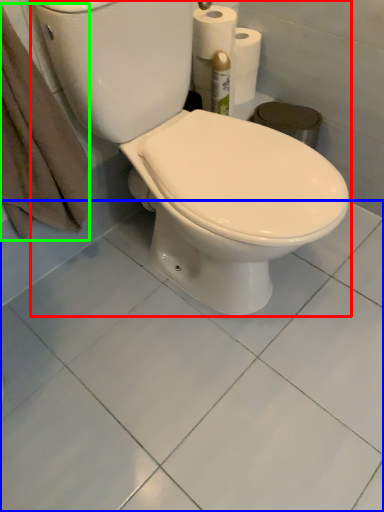
Question: Estimate the real-world distances between objects in this image. Which object is farther from toilet (highlighted by a red box), ceramic tile (highlighted by a blue box) or bath towel (highlighted by a green box)?

Choices:
 (A) ceramic tile
 (B) bath towel

Answer: (A)